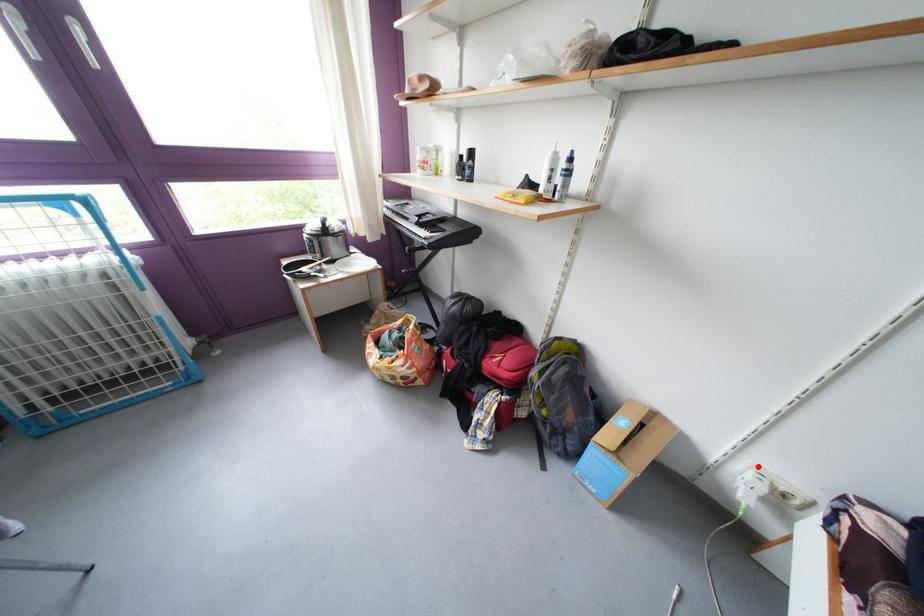
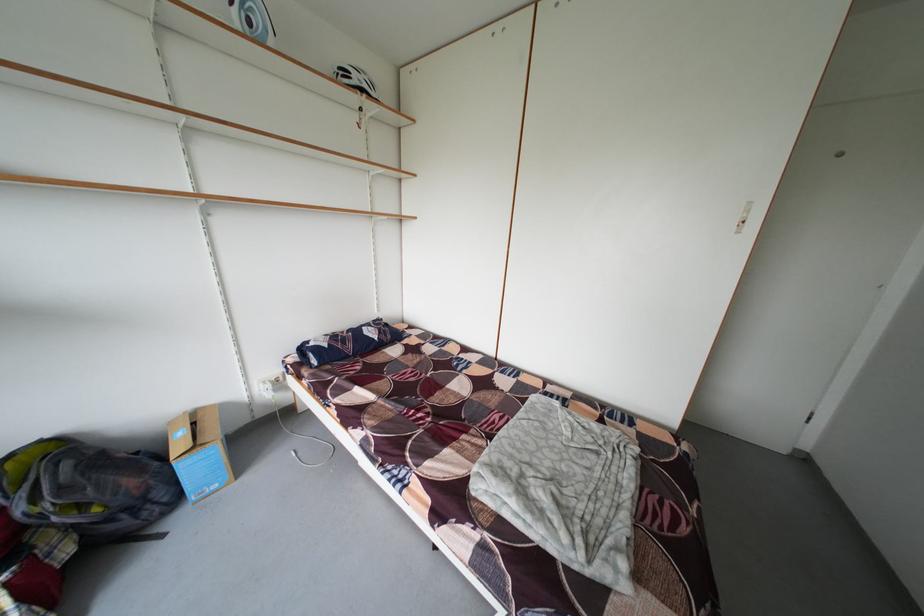
Question: I am providing you with two images of the same scene from different viewpoints. In image1, a red point is highlighted. Considering the same 3D point in image2, which of the following is correct?

Choices:
 (A) It is closer
 (B) It is farther

Answer: (B)